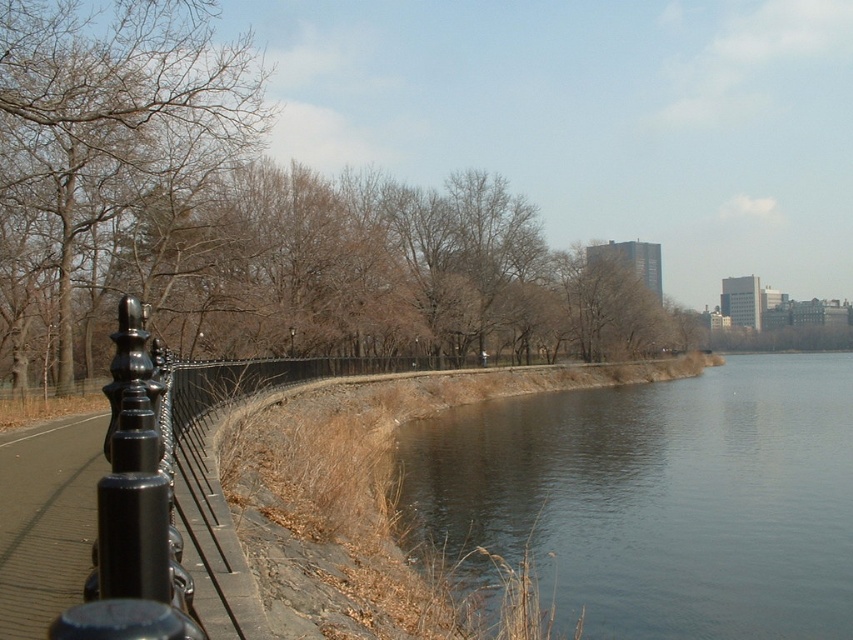
Question: Is brown leafy tree at left below black metal fence at left?

Choices:
 (A) no
 (B) yes

Answer: (A)

Question: Does dark gray water at lower right come in front of black metal fence at left?

Choices:
 (A) no
 (B) yes

Answer: (A)

Question: Based on their relative distances, which object is farther from the brown leafy tree at left?

Choices:
 (A) brown leafless tree at left
 (B) dark gray water at lower right
 (C) black metal fence at left

Answer: (C)

Question: Estimate the real-world distances between objects in this image. Which object is farther from the dark gray water at lower right?

Choices:
 (A) brown leafy tree at left
 (B) brown leafless tree at left

Answer: (B)

Question: Which of the following is the farthest from the observer?

Choices:
 (A) (585, 397)
 (B) (155, 36)

Answer: (A)

Question: Is brown leafless tree at left further to the viewer compared to black metal fence at left?

Choices:
 (A) no
 (B) yes

Answer: (B)